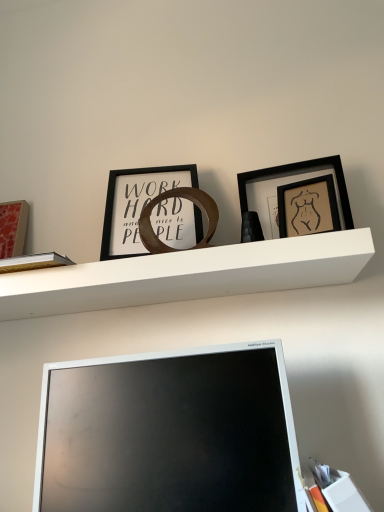
Question: Can you confirm if white matte shelf at center is shorter than white paper at lower right?

Choices:
 (A) no
 (B) yes

Answer: (B)

Question: From the image's perspective, is white matte shelf at center located beneath white paper at lower right?

Choices:
 (A) no
 (B) yes

Answer: (A)

Question: From a real-world perspective, is white matte shelf at center physically above white paper at lower right?

Choices:
 (A) yes
 (B) no

Answer: (A)

Question: From the image's perspective, is white matte shelf at center on top of white paper at lower right?

Choices:
 (A) yes
 (B) no

Answer: (A)

Question: Can you confirm if white matte shelf at center is smaller than white paper at lower right?

Choices:
 (A) no
 (B) yes

Answer: (A)

Question: Is matte red picture frame at left, the third picture frame viewed from the right, wider or thinner than white paper at lower right?

Choices:
 (A) wide
 (B) thin

Answer: (B)

Question: In the image, is matte red picture frame at left, the third picture frame viewed from the right, on the left side or the right side of white paper at lower right?

Choices:
 (A) right
 (B) left

Answer: (B)

Question: From the image's perspective, is matte red picture frame at left, placed as the first picture frame when sorted from left to right, located above or below white paper at lower right?

Choices:
 (A) above
 (B) below

Answer: (A)

Question: Is matte red picture frame at left, the third picture frame viewed from the right, bigger or smaller than white paper at lower right?

Choices:
 (A) small
 (B) big

Answer: (A)

Question: Is white matte shelf at center bigger or smaller than white paper at lower right?

Choices:
 (A) small
 (B) big

Answer: (B)

Question: Considering the positions of point (233, 268) and point (349, 500), is point (233, 268) closer or farther from the camera than point (349, 500)?

Choices:
 (A) closer
 (B) farther

Answer: (B)

Question: From a real-world perspective, relative to white paper at lower right, is white matte shelf at center vertically above or below?

Choices:
 (A) above
 (B) below

Answer: (A)

Question: Choose the correct answer: Is white matte shelf at center inside white paper at lower right or outside it?

Choices:
 (A) outside
 (B) inside

Answer: (A)

Question: Does point (306, 172) appear closer or farther from the camera than point (183, 502)?

Choices:
 (A) closer
 (B) farther

Answer: (B)

Question: Based on their sizes in the image, would you say matte black picture frame at upper right, which ranks as the 3th picture frame in left-to-right order, is bigger or smaller than matte silver monitor at lower center?

Choices:
 (A) small
 (B) big

Answer: (A)